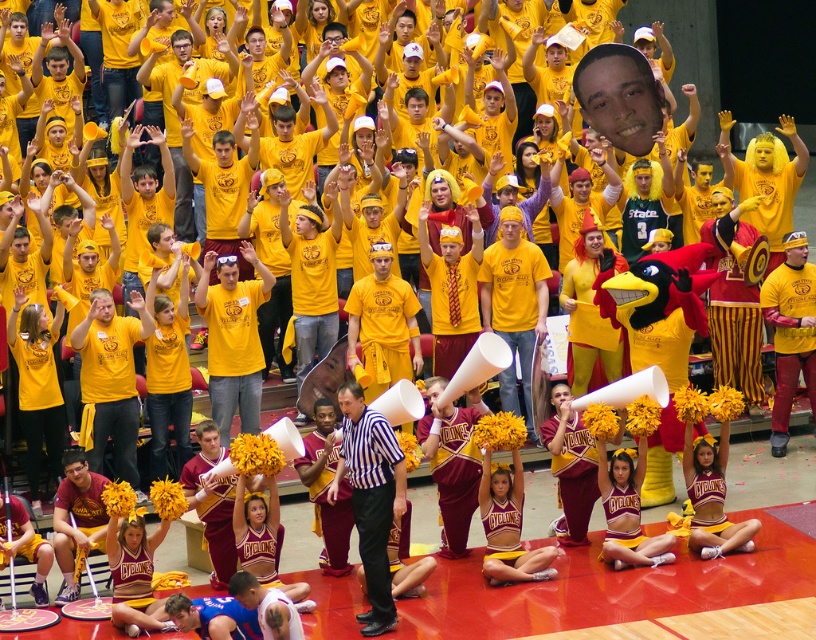
Who is taller, black striped shirt at center or maroon jersey at lower left?

black striped shirt at center

Can you confirm if black striped shirt at center is smaller than maroon jersey at lower left?

Incorrect, black striped shirt at center is not smaller in size than maroon jersey at lower left.

You are a GUI agent. You are given a task and a screenshot of the screen. Output one action in this format:
    pyautogui.click(x=<x>, y=<y>)
    Task: Click on the black striped shirt at center
    The height and width of the screenshot is (640, 816).
    Given the screenshot: What is the action you would take?
    pyautogui.click(x=370, y=497)

Locate an element on the screen. black striped shirt at center is located at coordinates (370, 497).

Is yellow jersey at center to the left of blue jersey at lower center from the viewer's perspective?

Incorrect, yellow jersey at center is not on the left side of blue jersey at lower center.

From the picture: Does yellow jersey at center appear on the right side of blue jersey at lower center?

Yes, yellow jersey at center is to the right of blue jersey at lower center.

In order to click on yellow jersey at center in this screenshot , I will do `click(790, 332)`.

The image size is (816, 640). In order to click on yellow jersey at center in this screenshot , I will do `click(790, 332)`.

Based on the photo, can you confirm if yellow jersey at center is positioned below maroon jersey at lower left?

No.

Between yellow jersey at center and maroon jersey at lower left, which one appears on the left side from the viewer's perspective?

maroon jersey at lower left

Between point (795, 300) and point (74, 545), which one is positioned in front?

Point (74, 545) is in front.

At what (x,y) coordinates should I click in order to perform the action: click on yellow jersey at center. Please return your answer as a coordinate pair (x, y). The height and width of the screenshot is (640, 816). Looking at the image, I should click on (790, 332).